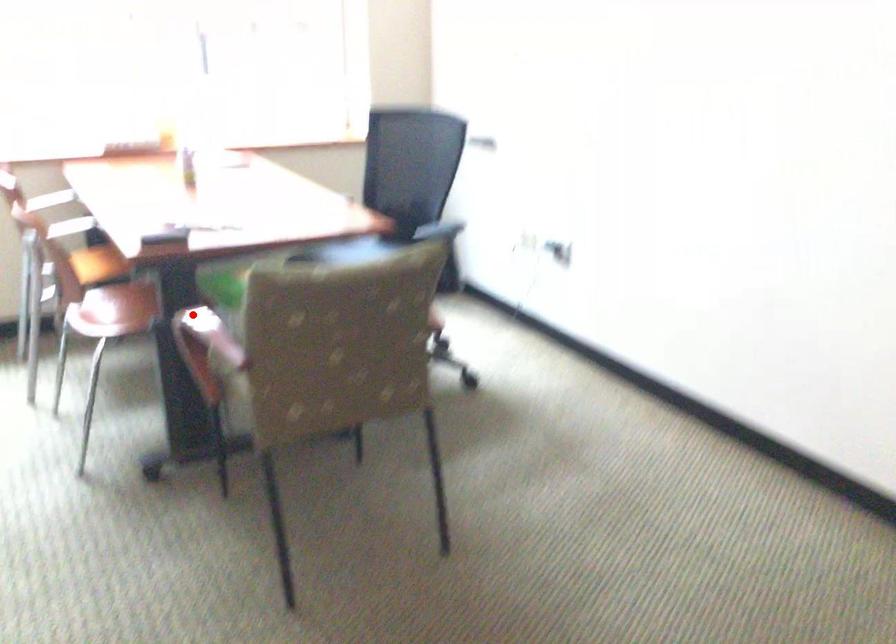
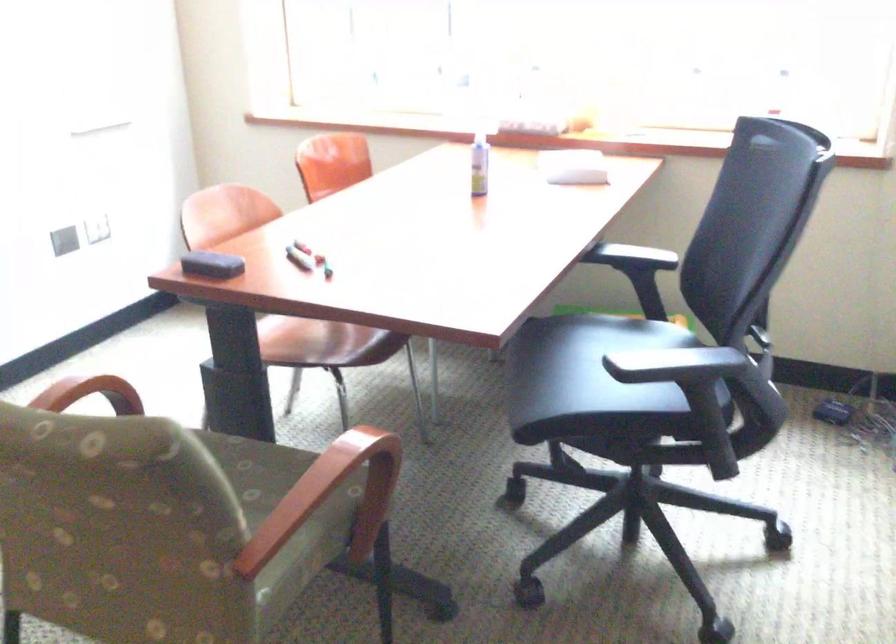
Where in the second image is the point corresponding to the highlighted location from the first image?

(90, 393)